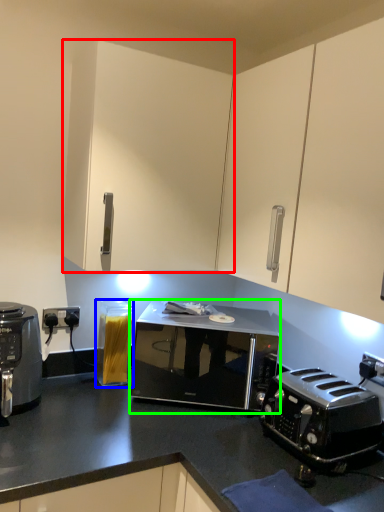
Question: Estimate the real-world distances between objects in this image. Which object is farther from cabinetry (highlighted by a red box), appliance (highlighted by a blue box) or microwave oven (highlighted by a green box)?

Choices:
 (A) appliance
 (B) microwave oven

Answer: (A)